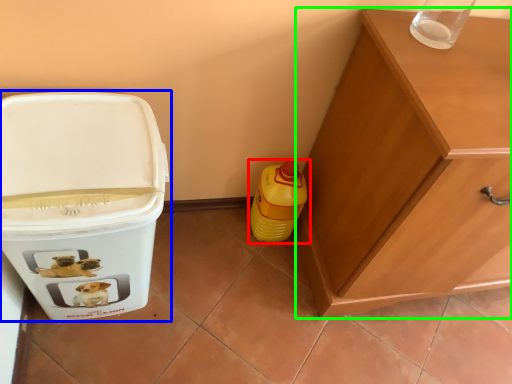
Question: Which object is positioned farthest from bottle (highlighted by a red box)? Select from waste container (highlighted by a blue box) and cabinetry (highlighted by a green box).

Choices:
 (A) waste container
 (B) cabinetry

Answer: (A)